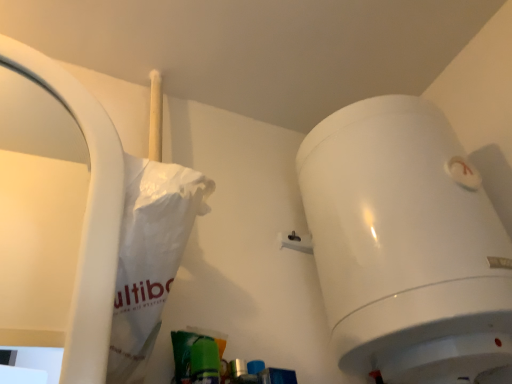
Question: Is white glossy toilet at upper right in front of white paper bag at left?

Choices:
 (A) no
 (B) yes

Answer: (A)

Question: From a real-world perspective, is white glossy toilet at upper right physically above white paper bag at left?

Choices:
 (A) yes
 (B) no

Answer: (A)

Question: Does white glossy toilet at upper right come behind white paper bag at left?

Choices:
 (A) no
 (B) yes

Answer: (B)

Question: From the image's perspective, would you say white glossy toilet at upper right is shown under white paper bag at left?

Choices:
 (A) yes
 (B) no

Answer: (A)

Question: Is white glossy toilet at upper right located outside white paper bag at left?

Choices:
 (A) yes
 (B) no

Answer: (A)

Question: Considering the relative sizes of white glossy toilet at upper right and white paper bag at left in the image provided, is white glossy toilet at upper right thinner than white paper bag at left?

Choices:
 (A) yes
 (B) no

Answer: (B)

Question: Are white paper bag at left and white glossy toilet at upper right located far from each other?

Choices:
 (A) yes
 (B) no

Answer: (B)

Question: Considering the relative sizes of white paper bag at left and white glossy toilet at upper right in the image provided, is white paper bag at left shorter than white glossy toilet at upper right?

Choices:
 (A) no
 (B) yes

Answer: (B)

Question: Can we say white paper bag at left lies outside white glossy toilet at upper right?

Choices:
 (A) yes
 (B) no

Answer: (A)

Question: Is white paper bag at left looking in the opposite direction of white glossy toilet at upper right?

Choices:
 (A) yes
 (B) no

Answer: (B)

Question: Considering the relative positions of white paper bag at left and white glossy toilet at upper right in the image provided, is white paper bag at left in front of white glossy toilet at upper right?

Choices:
 (A) no
 (B) yes

Answer: (B)

Question: Does white paper bag at left have a smaller size compared to white glossy toilet at upper right?

Choices:
 (A) no
 (B) yes

Answer: (B)

Question: Is white glossy toilet at upper right bigger or smaller than white paper bag at left?

Choices:
 (A) small
 (B) big

Answer: (B)